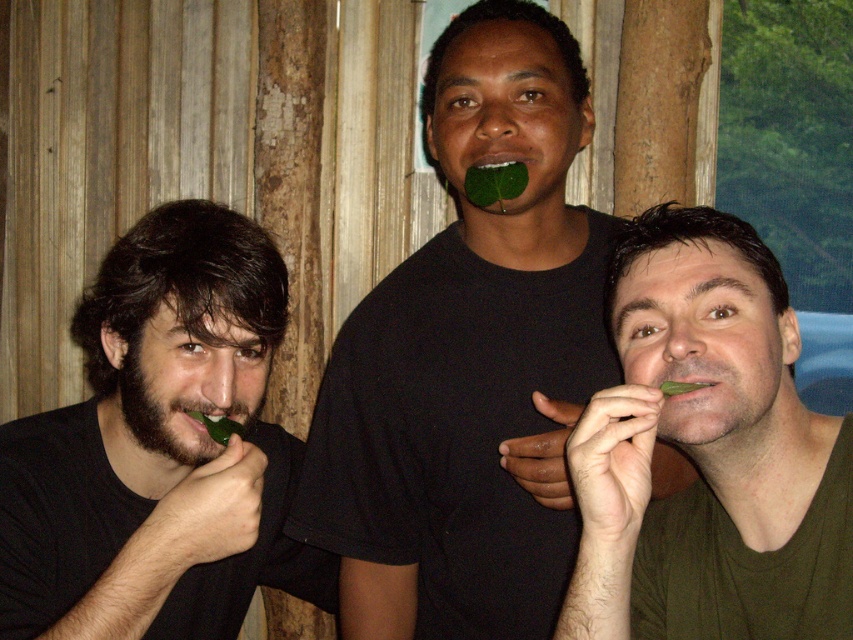
Question: From the image, what is the correct spatial relationship of green matte leaf at center in relation to dark brown hair at left?

Choices:
 (A) right
 (B) left

Answer: (A)

Question: Which point is closer to the camera taking this photo?

Choices:
 (A) (231, 444)
 (B) (582, 248)

Answer: (A)

Question: Is green matte leaf at center to the left of dark brown hair at left from the viewer's perspective?

Choices:
 (A) no
 (B) yes

Answer: (A)

Question: Which point is closer to the camera taking this photo?

Choices:
 (A) (233, 518)
 (B) (583, 227)

Answer: (A)

Question: Does green matte leaf at center appear on the left side of dark brown hair at left?

Choices:
 (A) no
 (B) yes

Answer: (A)